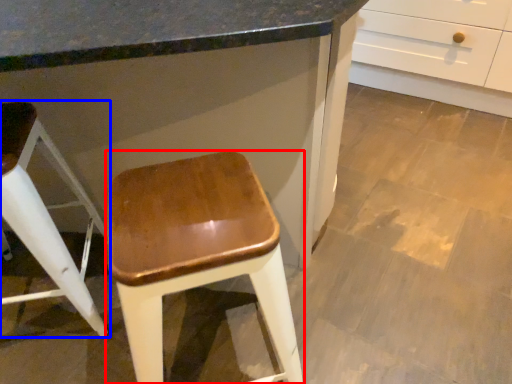
Question: Which object appears farthest to the camera in this image, stool (highlighted by a red box) or stool (highlighted by a blue box)?

Choices:
 (A) stool
 (B) stool

Answer: (B)